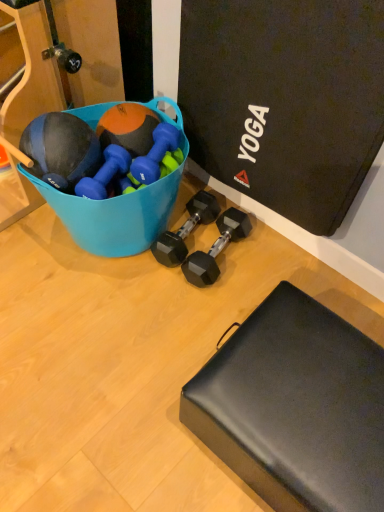
Find the location of `vacant space that is to the left of black rubber dumbbell at center, which is the 4th dumbbell in left-to-right order`. vacant space that is to the left of black rubber dumbbell at center, which is the 4th dumbbell in left-to-right order is located at coordinates (156, 274).